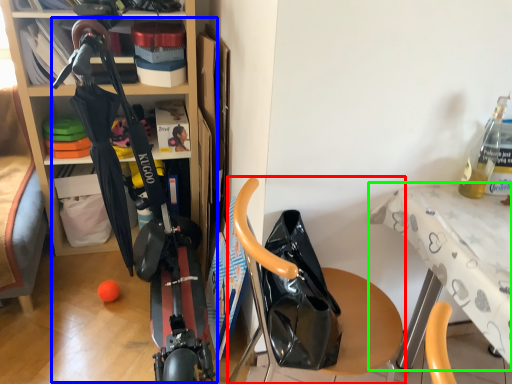
Question: Which is nearer to the furniture (highlighted by a red box)? sport equipment (highlighted by a blue box) or table (highlighted by a green box).

Choices:
 (A) sport equipment
 (B) table

Answer: (B)